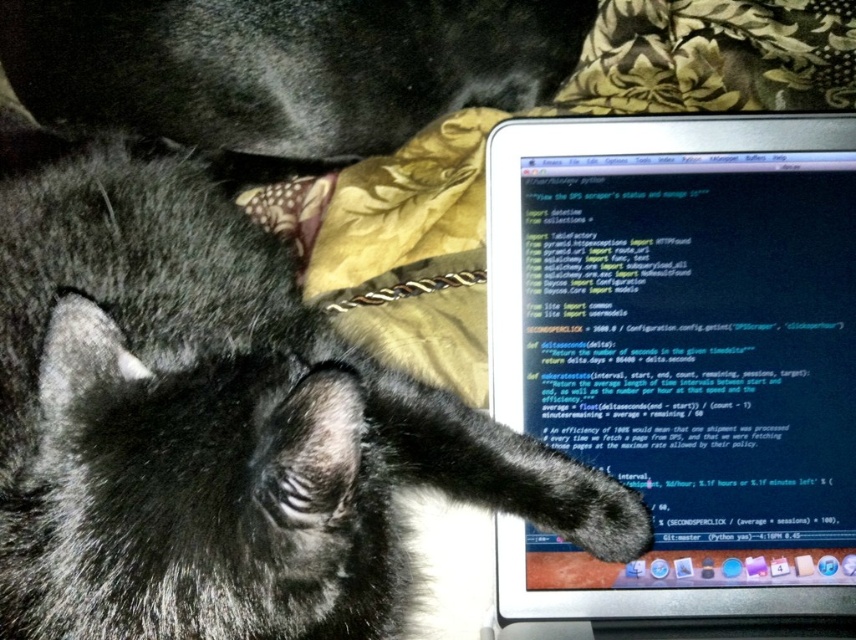
Consider the image. You are a delivery robot that needs to place a small package between the black cat and the matte black laptop at upper right. The package requires at least 30 inches of space to fit. Can you fit the package there?

The distance between the black cat and the matte black laptop at upper right is 34.39 inches, which is more than the required 30 inches. Therefore, the package can be placed there.

In the scene shown: You are a robotic arm trying to pick up the black cat lying on a surface next to an open laptop. The robotic arm has a reach of 35 inches. Can you safely reach the point at coordinates point (675,371) from the cat?

The distance between the black cat lying on a surface next to an open laptop and the point at coordinates point (675,371) is 35.31 inches. Since the robotic arm has a reach of 35 inches, it cannot safely reach the point at coordinates point (675,371) from the cat.

You are a photographer trying to capture both the black fur cat at center and the black fur cat at upper left in a single shot. Which cat will appear larger in the photo?

The black fur cat at center will appear larger in the photo because it has a greater height compared to the black fur cat at upper left.